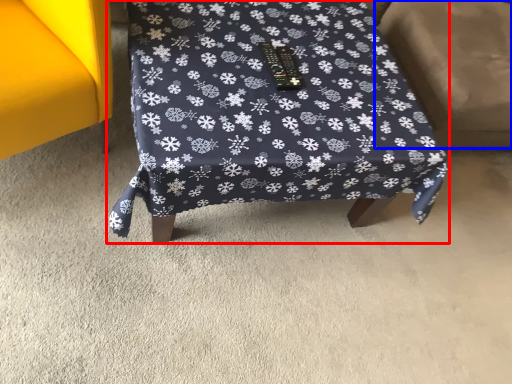
Question: Which point is closer to the camera, furniture (highlighted by a red box) or swivel chair (highlighted by a blue box)?

Choices:
 (A) furniture
 (B) swivel chair

Answer: (A)